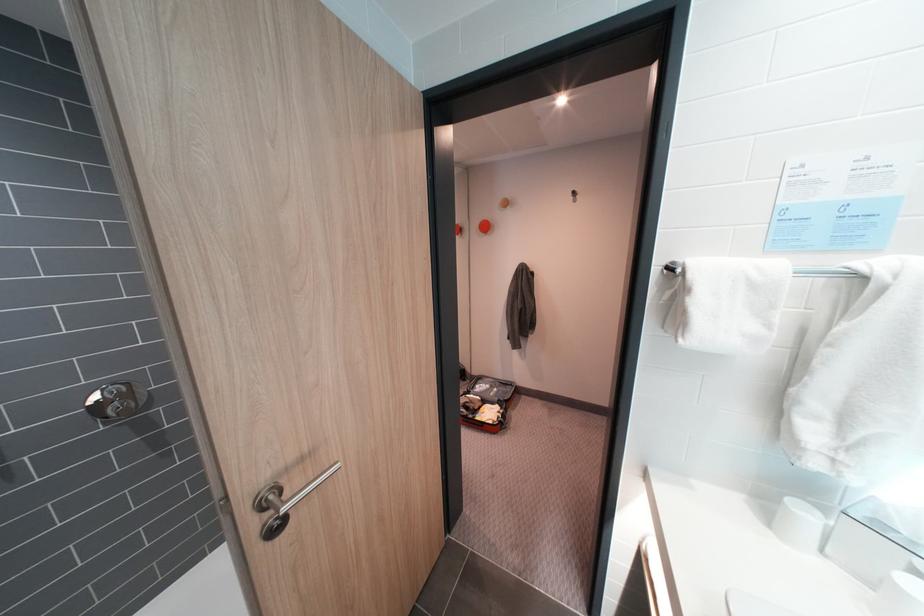
Find the location of `red wall hook`. red wall hook is located at coordinates (483, 225).